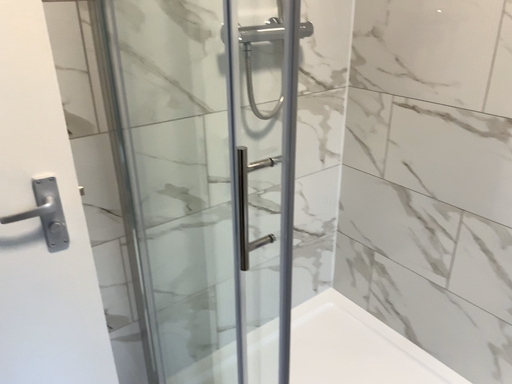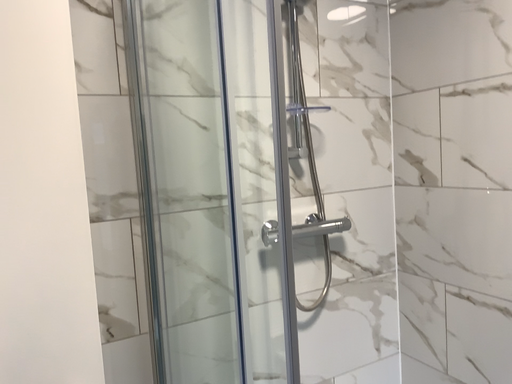
Question: How did the camera likely rotate when shooting the video?

Choices:
 (A) rotated downward
 (B) rotated upward

Answer: (B)